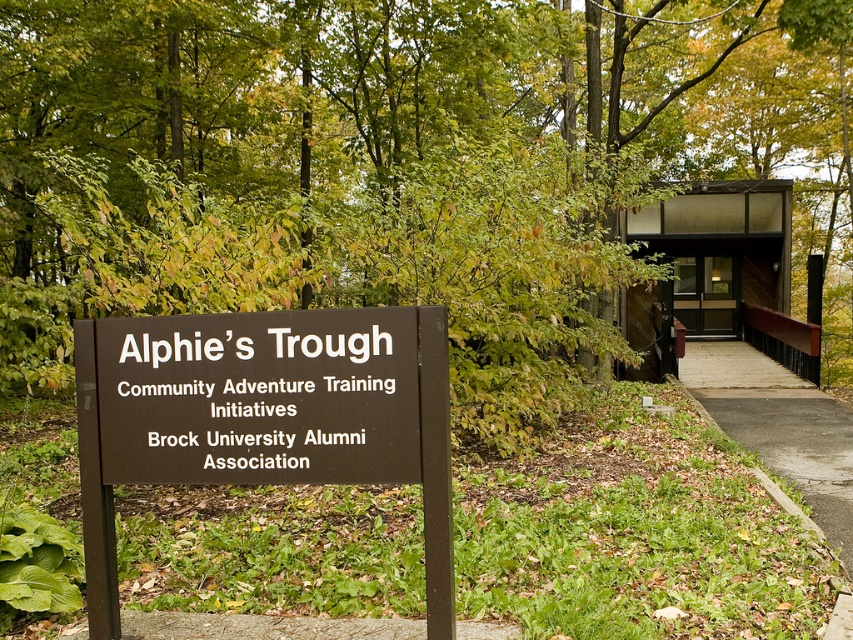
Question: Does green leafy tree at center have a larger size compared to asphalt pavement at center?

Choices:
 (A) no
 (B) yes

Answer: (B)

Question: Which point is closer to the camera taking this photo?

Choices:
 (A) pyautogui.click(x=77, y=52)
 (B) pyautogui.click(x=833, y=417)

Answer: (A)

Question: Can you confirm if green leafy tree at center is positioned to the right of brown matte sign at center?

Choices:
 (A) no
 (B) yes

Answer: (B)

Question: Is green leafy tree at center wider than asphalt pavement at center?

Choices:
 (A) yes
 (B) no

Answer: (A)

Question: Which object is closer to the camera taking this photo?

Choices:
 (A) brown matte sign at center
 (B) green leafy tree at center
 (C) asphalt pavement at center

Answer: (A)

Question: Which of the following is the closest to the observer?

Choices:
 (A) (703, 3)
 (B) (834, 401)
 (C) (251, 330)

Answer: (C)